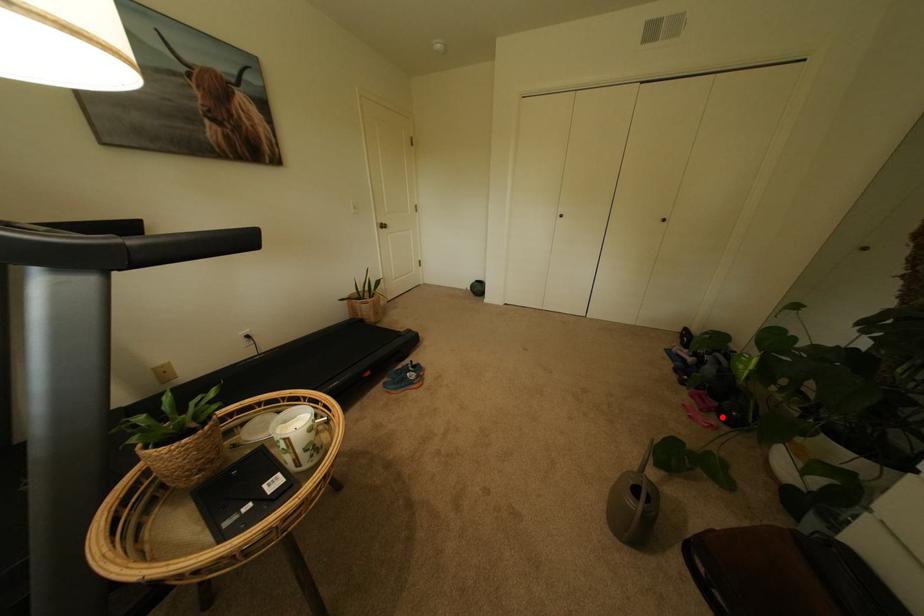
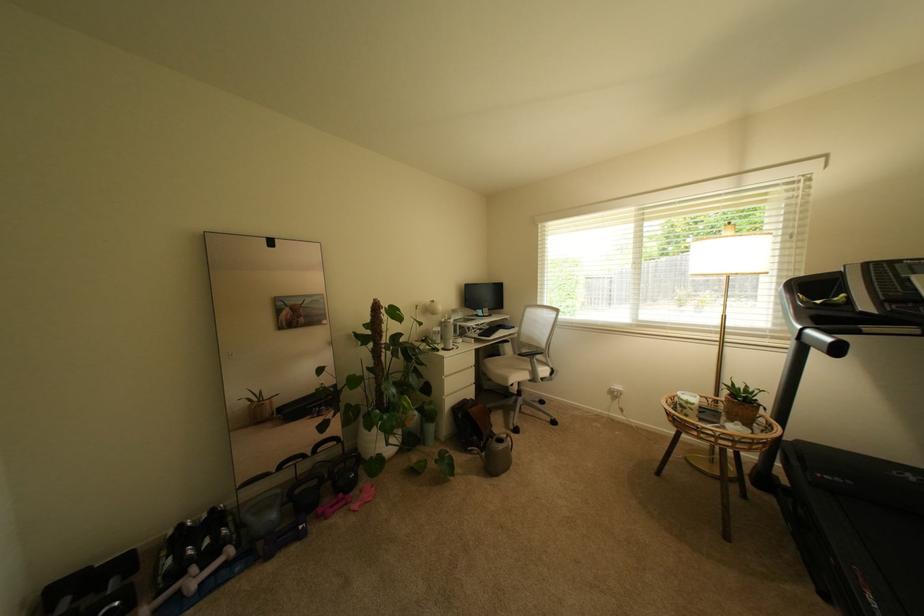
Question: I am providing you with two images of the same scene from different viewpoints. Given a red point in image1, look at the same physical point in image2. Is it:

Choices:
 (A) Closer to the viewpoint
 (B) Farther from the viewpoint

Answer: (B)